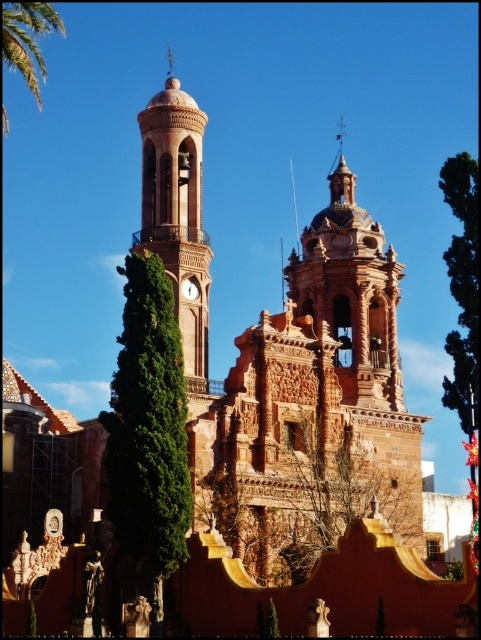
Question: Can you confirm if green leafy tree at center is positioned to the left of smooth terracotta bell tower at center?

Choices:
 (A) no
 (B) yes

Answer: (B)

Question: Considering the real-world distances, which object is closest to the green leafy palm tree at upper left?

Choices:
 (A) green leafy tree at upper right
 (B) smooth terracotta bell tower at center

Answer: (B)

Question: Which of these objects is positioned closest to the green leafy palm tree at upper left?

Choices:
 (A) green leafy tree at upper right
 (B) green leafy tree at center

Answer: (B)

Question: Is smooth terracotta bell tower at center to the left of green leafy palm tree at upper left from the viewer's perspective?

Choices:
 (A) no
 (B) yes

Answer: (A)

Question: Can you confirm if green leafy tree at center is thinner than green leafy tree at upper right?

Choices:
 (A) no
 (B) yes

Answer: (B)

Question: Estimate the real-world distances between objects in this image. Which object is farther from the green leafy tree at upper right?

Choices:
 (A) green leafy palm tree at upper left
 (B) smooth terracotta bell tower at center
 (C) green leafy tree at center

Answer: (A)